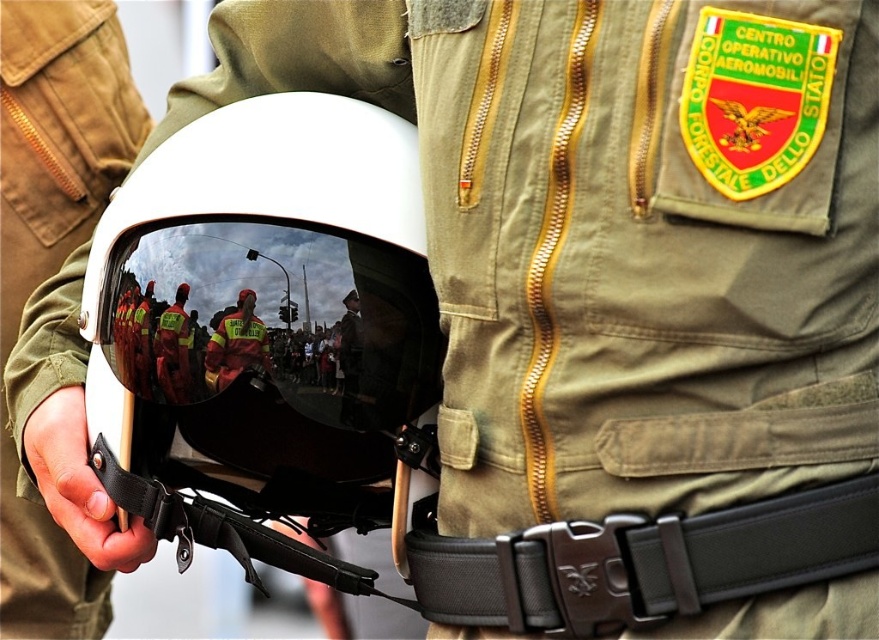
You are a photographer standing in front of the shiny reflective goggles at center. You need to take a clear photo of the goggles without any reflections. The camera you are using has a minimum focusing distance of 1.5 meters. Will you be able to take the photo without moving closer?

The shiny reflective goggles at center are 1.38 meters away from the viewer. Since the camera requires a minimum focusing distance of 1.5 meters, you are too close to focus properly. Move back to ensure the distance is at least 1.5 meters for a clear photo without reflections.

You are a photographer trying to capture the person in the image. Since the shiny reflective goggles at center and reflective plastic helmet at center are both reflective, which object is more to the right when you look at the image?

The shiny reflective goggles at center is more to the right than the reflective plastic helmet at center.

From the picture: You are a photographer trying to capture the details of the shiny reflective goggles at center and the reflective yellow vest at center. Which object should you zoom in on if you want to fill the frame more with the object?

The shiny reflective goggles at center is bigger than the reflective yellow vest at center, so zooming in on the shiny reflective goggles at center will fill the frame more.